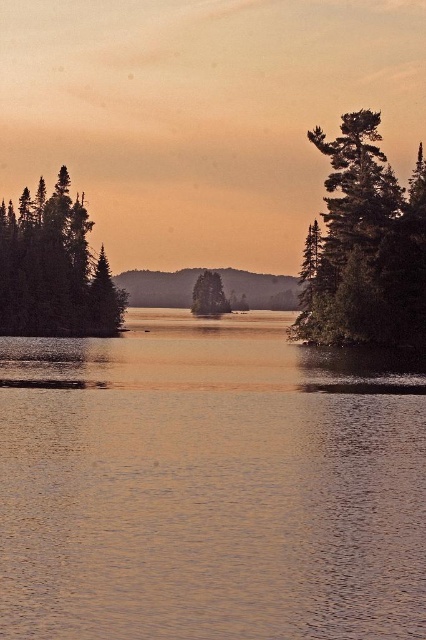
Is point (31, 316) positioned after point (201, 278)?

No, it is not.

Is green matte tree at left to the right of green matte tree at center from the viewer's perspective?

No, green matte tree at left is not to the right of green matte tree at center.

Between point (17, 221) and point (213, 312), which one is positioned behind?

Point (213, 312)

You are a GUI agent. You are given a task and a screenshot of the screen. Output one action in this format:
    pyautogui.click(x=<x>, y=<y>)
    Task: Click on the green matte tree at left
    The image size is (426, 640).
    Given the screenshot: What is the action you would take?
    pyautogui.click(x=54, y=268)

I want to click on golden reflective water at center, so click(210, 484).

Is golden reflective water at center positioned behind green matte tree at right?

That is False.

Between point (325, 547) and point (383, 154), which one is positioned in front?

Point (325, 547) is more forward.

This screenshot has height=640, width=426. What are the coordinates of `golden reflective water at center` in the screenshot? It's located at (210, 484).

Looking at this image, can you confirm if golden reflective water at center is smaller than green matte tree at center?

Incorrect, golden reflective water at center is not smaller in size than green matte tree at center.

Does point (0, 378) lie behind point (215, 310)?

No, it is in front of (215, 310).

At what (x,y) coordinates should I click in order to perform the action: click on golden reflective water at center. Please return your answer as a coordinate pair (x, y). Looking at the image, I should click on (210, 484).